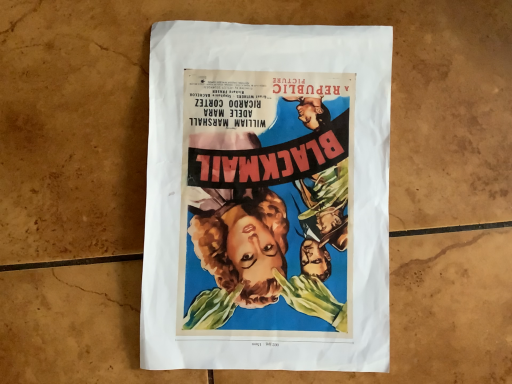
Identify the location of vibrant paper poster at center. (267, 198).

Image resolution: width=512 pixels, height=384 pixels. Describe the element at coordinates (267, 198) in the screenshot. I see `vibrant paper poster at center` at that location.

What is the approximate height of vibrant paper poster at center?

vibrant paper poster at center is 1.06 inches tall.

Where is `vibrant paper poster at center`? This screenshot has height=384, width=512. vibrant paper poster at center is located at coordinates (267, 198).